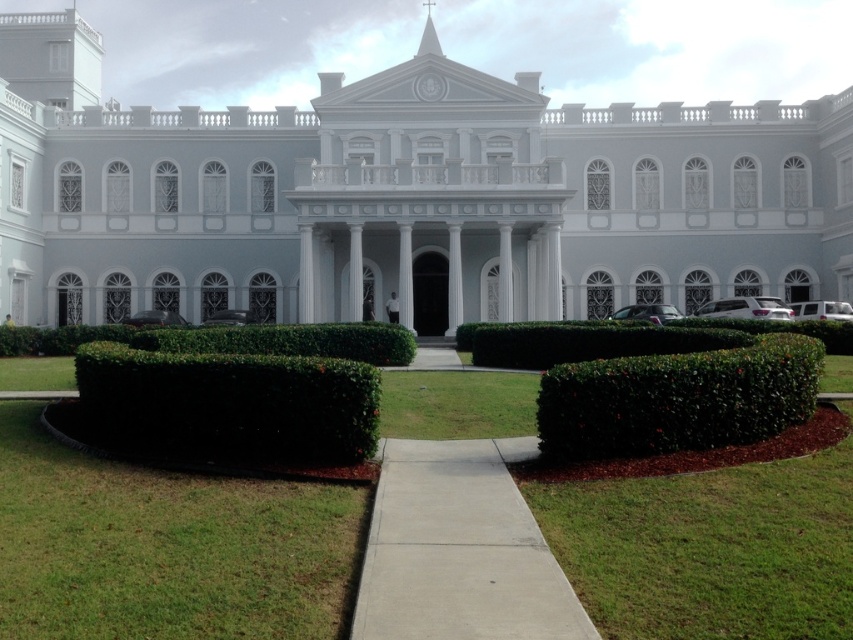
Who is taller, dark green hedge at lower left or green leafy bush at lower right?

Standing taller between the two is green leafy bush at lower right.

Can you confirm if dark green hedge at lower left is positioned below green leafy bush at lower right?

No, dark green hedge at lower left is not below green leafy bush at lower right.

You are a GUI agent. You are given a task and a screenshot of the screen. Output one action in this format:
    pyautogui.click(x=<x>, y=<y>)
    Task: Click on the dark green hedge at lower left
    
    Given the screenshot: What is the action you would take?
    pyautogui.click(x=231, y=403)

Who is positioned more to the right, white marble palace at center or green leafy bush at center?

Positioned to the right is white marble palace at center.

Looking at this image, can you confirm if white marble palace at center is bigger than green leafy bush at center?

Indeed, white marble palace at center has a larger size compared to green leafy bush at center.

Between point (247, 228) and point (294, 337), which one is positioned in front?

Point (294, 337) is in front.

Image resolution: width=853 pixels, height=640 pixels. I want to click on white marble palace at center, so click(403, 196).

Which is more to the left, green leafy bush at lower right or green leafy hedge at center?

Positioned to the left is green leafy bush at lower right.

In order to click on green leafy bush at lower right in this screenshot , I will do `click(677, 396)`.

Where is `green leafy bush at lower right`? This screenshot has height=640, width=853. green leafy bush at lower right is located at coordinates (677, 396).